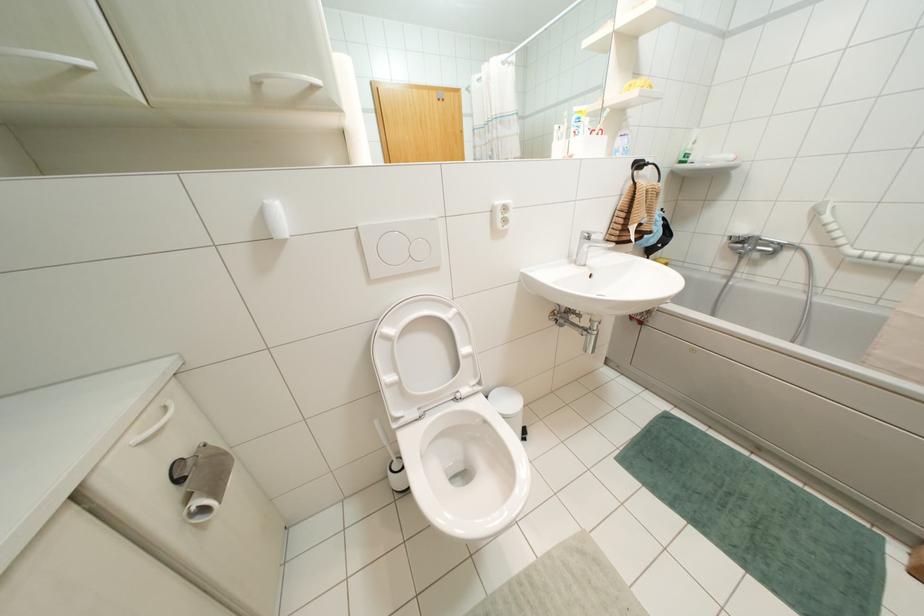
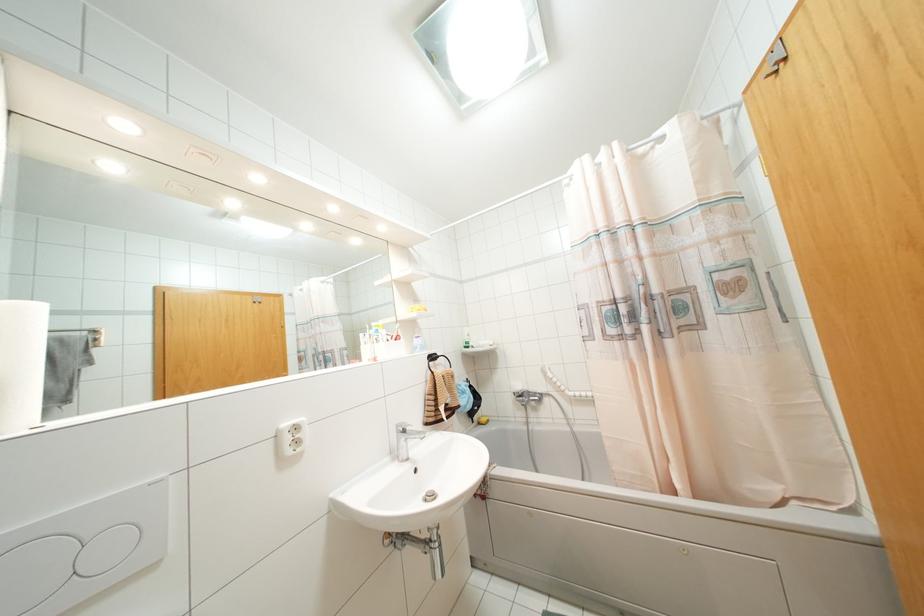
Locate, in the second image, the point that corresponds to pixel 694 142 in the first image.

(468, 334)